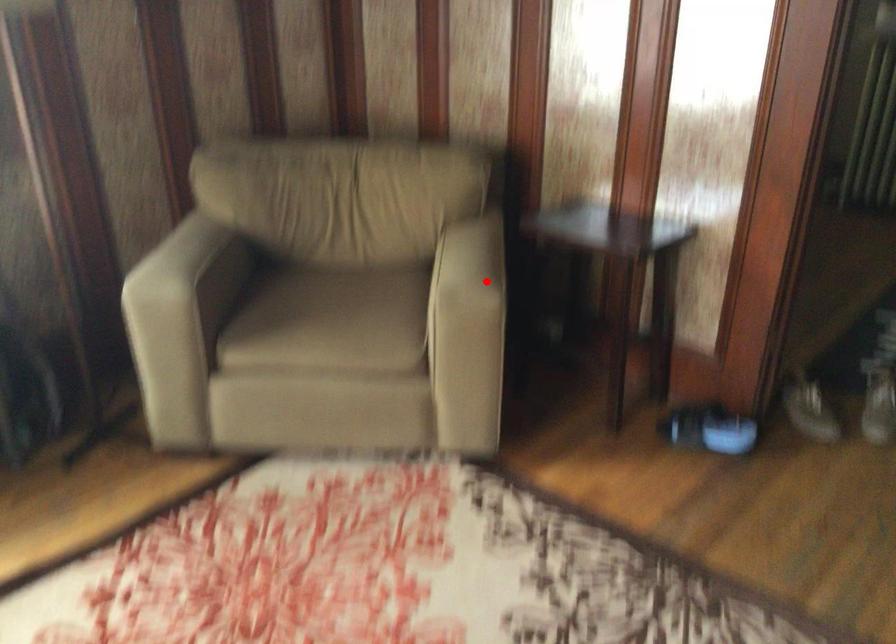
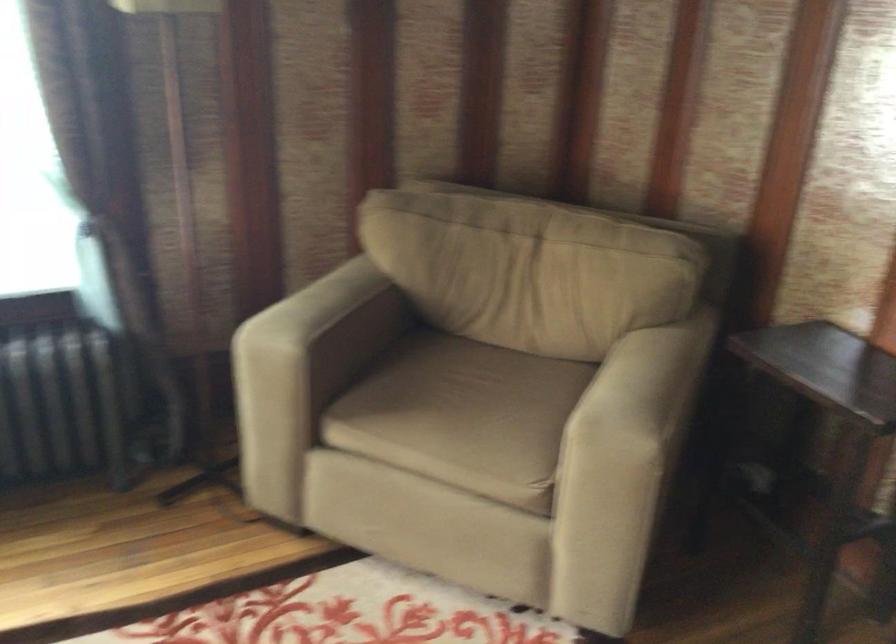
Find the pixel in the second image that matches the highlighted location in the first image.

(640, 413)